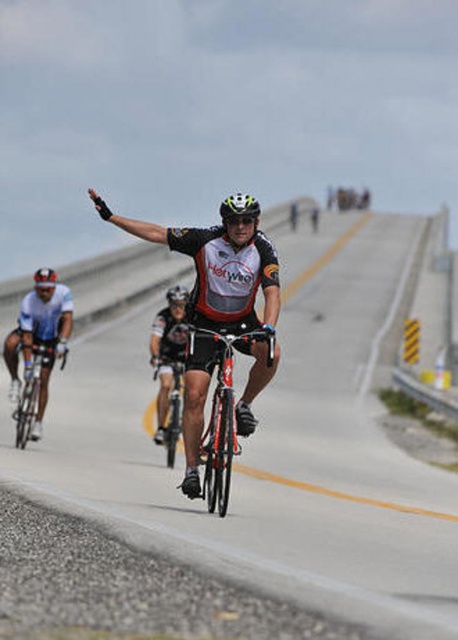
Question: Where is shiny silver bicycle at left located in relation to black matte bicycle helmet at center in the image?

Choices:
 (A) above
 (B) below

Answer: (B)

Question: Which of the following is the farthest from the observer?

Choices:
 (A) black matte bicycle helmet at center
 (B) matte black bicycle at center
 (C) white matte bicycle helmet at center

Answer: (A)

Question: Which of the following is the farthest from the observer?

Choices:
 (A) black matte bicycle helmet at center
 (B) shiny metallic bicycle at center

Answer: (A)

Question: Which point is farther to the camera?

Choices:
 (A) (33, 371)
 (B) (185, 300)
 (C) (48, 276)

Answer: (B)

Question: Can you confirm if shiny black bicycle at center is wider than white matte bicycle helmet at upper center?

Choices:
 (A) no
 (B) yes

Answer: (B)

Question: In this image, where is matte black bicycle at center located relative to shiny black bicycle at center?

Choices:
 (A) below
 (B) above

Answer: (B)